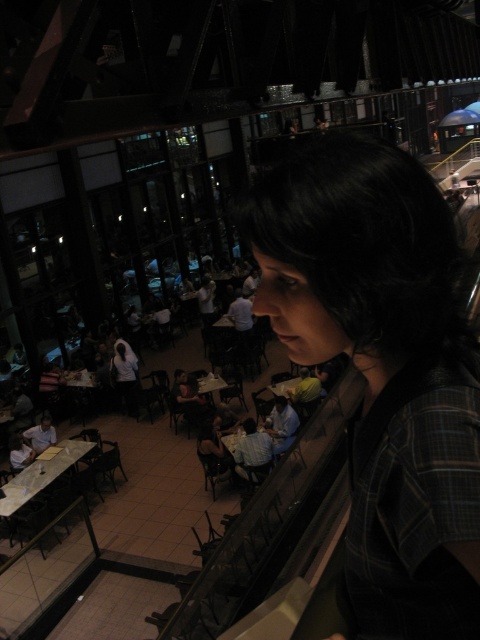
You are standing at the elevated vantage point overlooking the restaurant and want to determine the relative positions of two points in the scene. Which of the two points, point (22, 483) or point (229, 442), is closer to you?

Point (22, 483) is closer to the viewer than point (229, 442).

You are a photographer standing at the elevated vantage point. You want to capture a photo that includes both the plaid fabric shirt at center and the wooden table at center. Which object should you focus on first to ensure both are in frame?

The plaid fabric shirt at center is taller than the wooden table at center, so you should focus on the plaid fabric shirt at center first to ensure both are in frame.